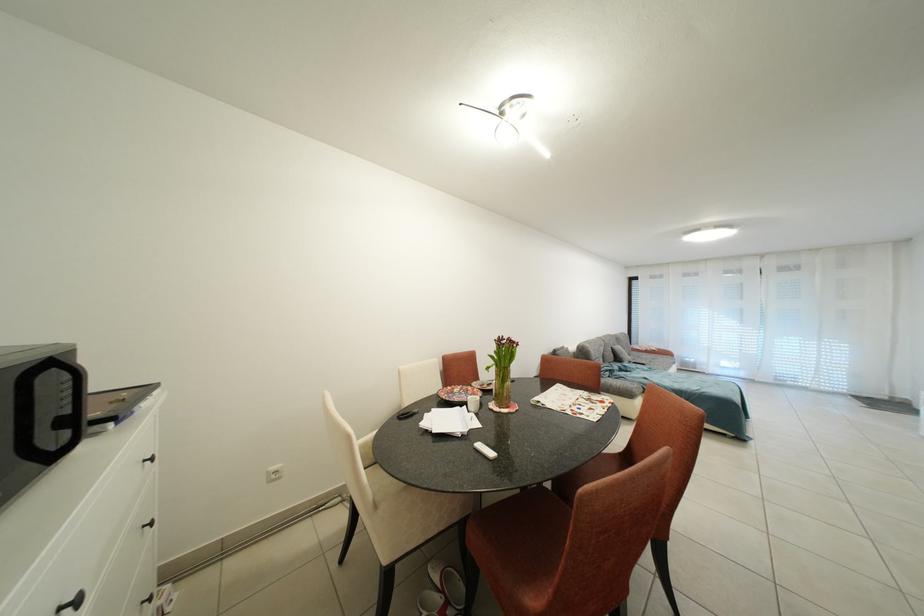
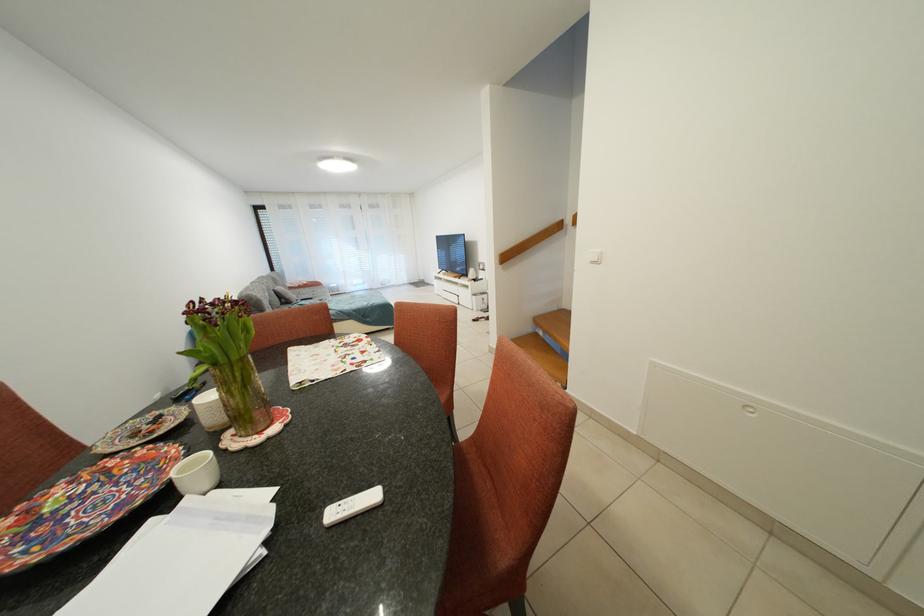
The point at (481,403) is marked in the first image. Where is the corresponding point in the second image?

(202, 471)